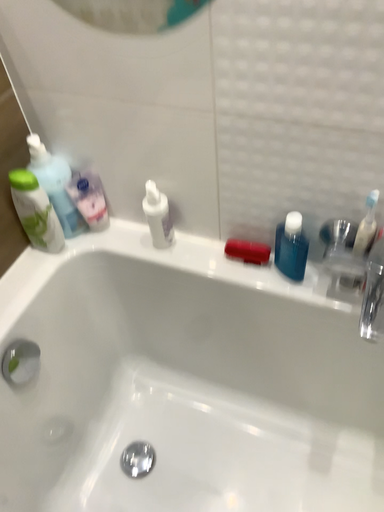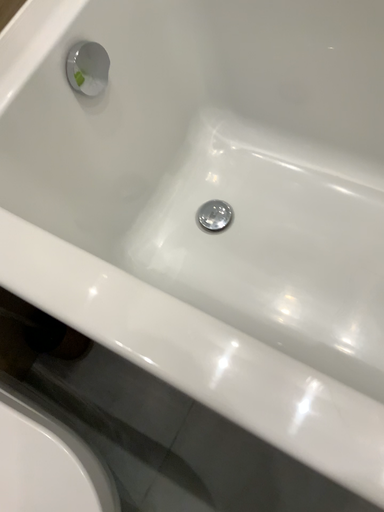
Question: Which way did the camera rotate in the video?

Choices:
 (A) rotated downward
 (B) rotated upward

Answer: (A)